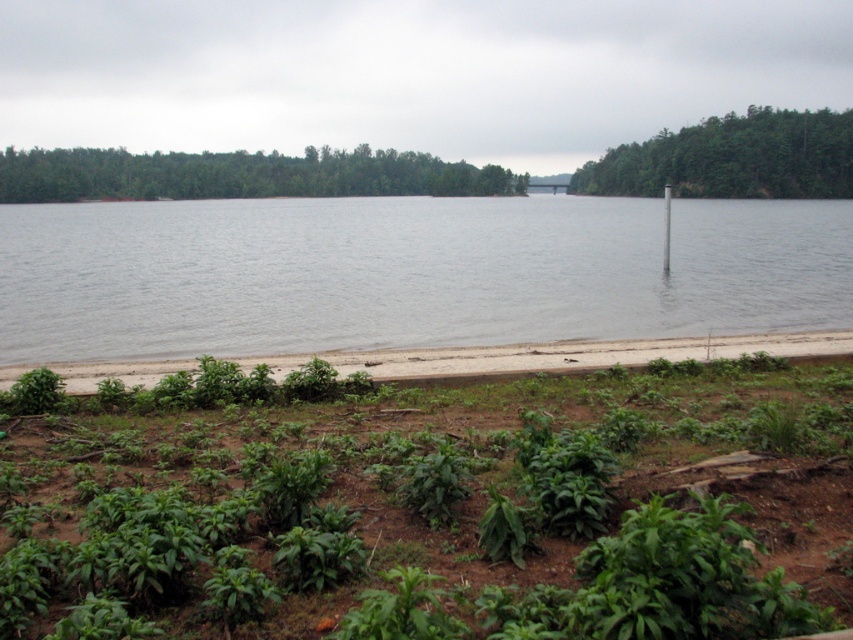
In the scene shown: Is the position of green leafy plants at lower center less distant than that of white plastic pole at center?

Yes, it is.

Between point (187, 628) and point (663, 241), which one is positioned in front?

Point (187, 628) is more forward.

Find the location of a particular element. This screenshot has height=640, width=853. green leafy plants at lower center is located at coordinates (437, 512).

Consider the image. Who is higher up, gray water at center or green grass at lower center?

gray water at center

Can you confirm if gray water at center is wider than green grass at lower center?

Yes, gray water at center is wider than green grass at lower center.

Image resolution: width=853 pixels, height=640 pixels. Find the location of `gray water at center`. gray water at center is located at coordinates (408, 273).

Is green leafy plants at lower center above green leafy trees at upper right?

No, green leafy plants at lower center is not above green leafy trees at upper right.

Is green leafy plants at lower center closer to the viewer compared to green leafy trees at upper right?

Yes, green leafy plants at lower center is closer to the viewer.

The width and height of the screenshot is (853, 640). Describe the element at coordinates (437, 512) in the screenshot. I see `green leafy plants at lower center` at that location.

This screenshot has width=853, height=640. I want to click on green leafy plants at lower center, so click(437, 512).